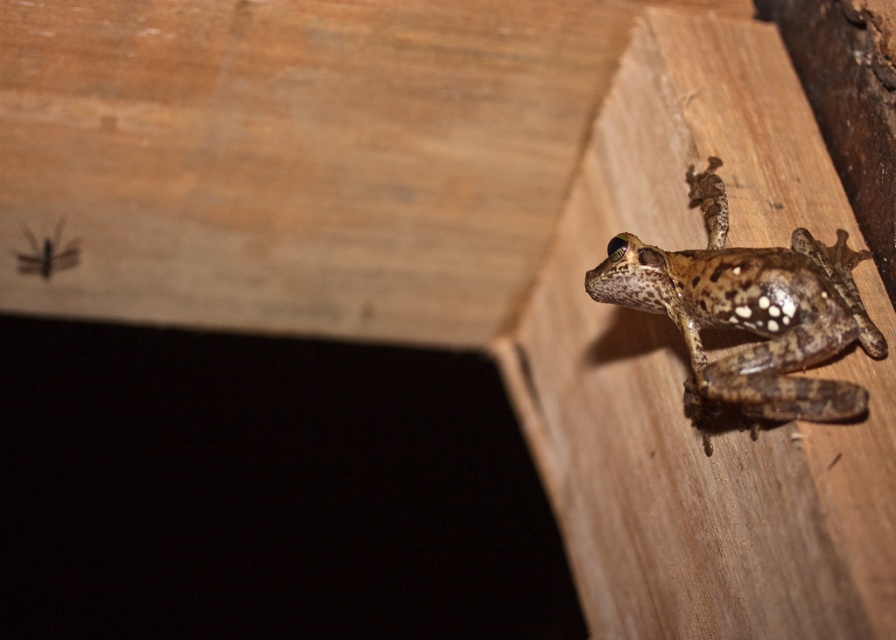
Question: Which object is closer to the camera taking this photo?

Choices:
 (A) brown wood plank at upper right
 (B) brown fuzzy insect at upper left

Answer: (A)

Question: Is brown wood plank at upper right bigger than speckled brown skin at upper right?

Choices:
 (A) yes
 (B) no

Answer: (A)

Question: Does brown wood plank at upper right have a greater width compared to speckled brown skin at upper right?

Choices:
 (A) no
 (B) yes

Answer: (B)

Question: Does brown wood plank at upper right have a lesser width compared to speckled brown skin at upper right?

Choices:
 (A) yes
 (B) no

Answer: (B)

Question: Among these points, which one is nearest to the camera?

Choices:
 (A) (701, 316)
 (B) (553, 452)

Answer: (A)

Question: Which point is farther to the camera?

Choices:
 (A) pyautogui.click(x=636, y=284)
 (B) pyautogui.click(x=37, y=272)
 (C) pyautogui.click(x=843, y=198)

Answer: (B)